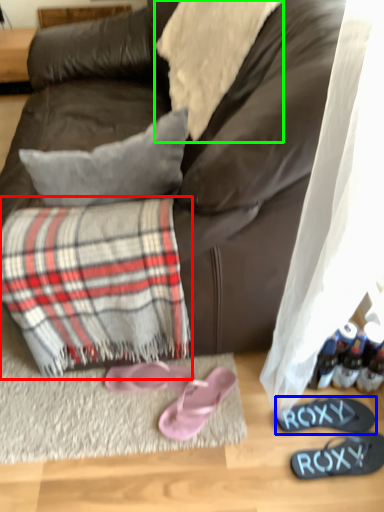
Question: Which object is positioned closest to flannel (highlighted by a red box)? Select from footwear (highlighted by a blue box) and cloth (highlighted by a green box).

Choices:
 (A) footwear
 (B) cloth

Answer: (A)